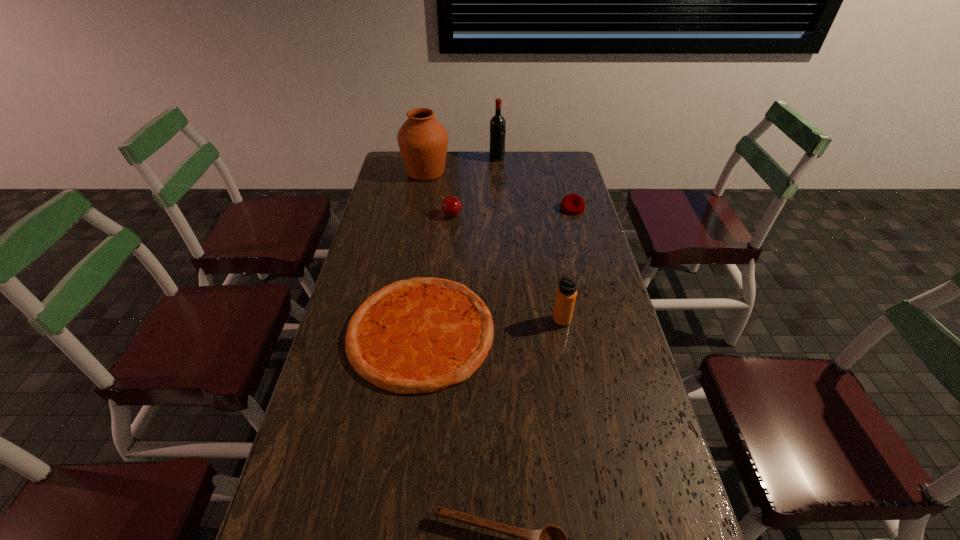
The height and width of the screenshot is (540, 960). Find the location of `free spot between the sixth object from left to right and the urn`. free spot between the sixth object from left to right and the urn is located at coordinates (493, 247).

The image size is (960, 540). In order to click on unoccupied position between the pizza and the urn in this screenshot , I will do `click(423, 252)`.

This screenshot has width=960, height=540. What are the coordinates of `vacant area between the fifth shortest object and the fifth tallest object` in the screenshot? It's located at (567, 265).

Image resolution: width=960 pixels, height=540 pixels. Find the location of `vacant area that lies between the pizza and the fourth tallest object`. vacant area that lies between the pizza and the fourth tallest object is located at coordinates (437, 273).

Image resolution: width=960 pixels, height=540 pixels. What are the coordinates of `vacant space that is in between the pizza and the cherry` in the screenshot? It's located at (437, 273).

Image resolution: width=960 pixels, height=540 pixels. In order to click on the fourth closest object relative to the wine bottle in this screenshot , I will do `click(421, 335)`.

Locate which object is the sixth closest to the urn. Please provide its 2D coordinates. Your answer should be formatted as a tuple, i.e. [(x, y)], where the tuple contains the x and y coordinates of a point satisfying the conditions above.

[(551, 539)]

Image resolution: width=960 pixels, height=540 pixels. I want to click on vacant area in the image that satisfies the following two spatial constraints: 1. on the front side of the wine bottle; 2. on the left side of the thermos bottle, so click(506, 321).